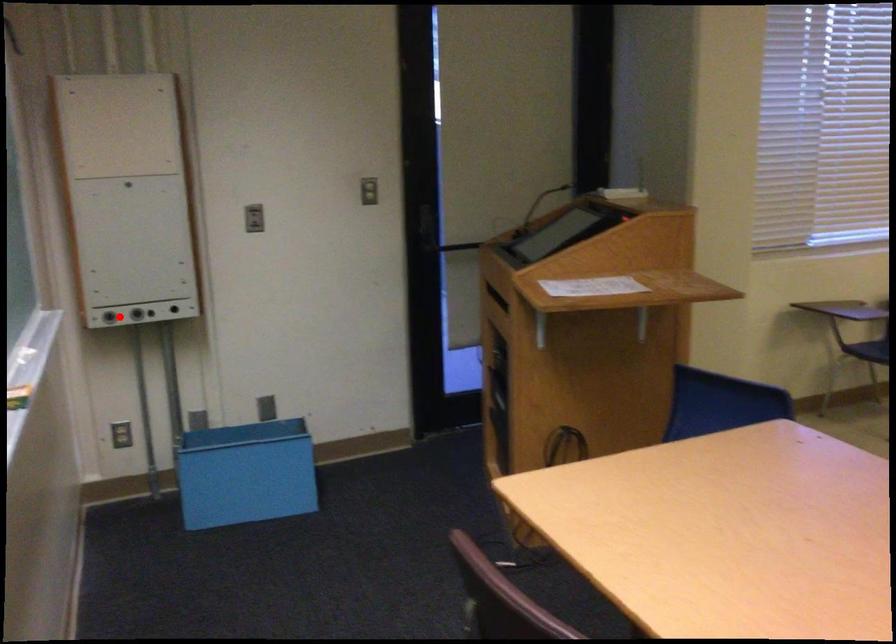
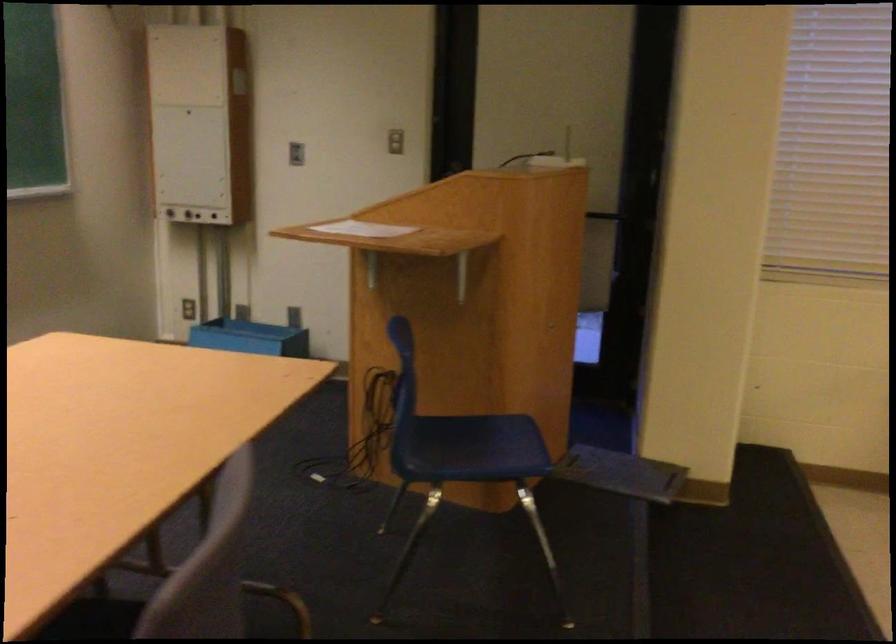
Question: I am providing you with two images of the same scene from different viewpoints. A red point is shown in image1. For the corresponding object point in image2, is it positioned nearer or farther from the camera?

Choices:
 (A) Nearer
 (B) Farther

Answer: (B)